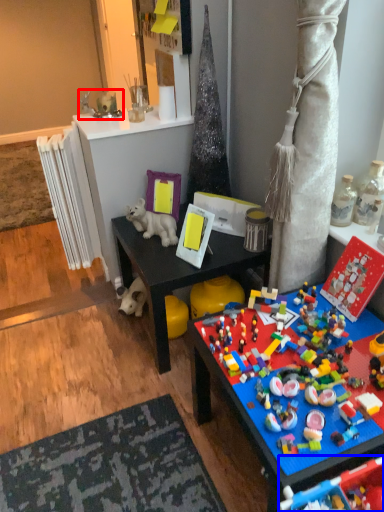
Question: Which point is closer to the camera, toy (highlighted by a red box) or toy (highlighted by a blue box)?

Choices:
 (A) toy
 (B) toy

Answer: (B)